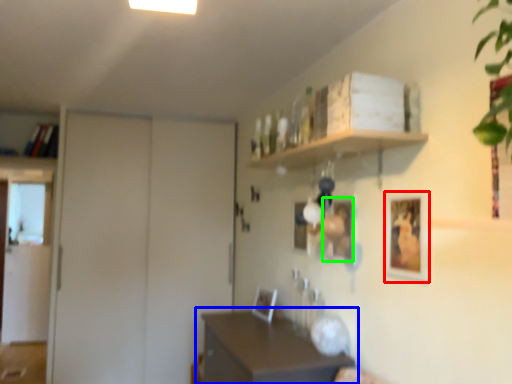
Question: Which object is the closest to the picture frame (highlighted by a red box)? Choose among these: table (highlighted by a blue box) or picture frame (highlighted by a green box).

Choices:
 (A) table
 (B) picture frame

Answer: (B)